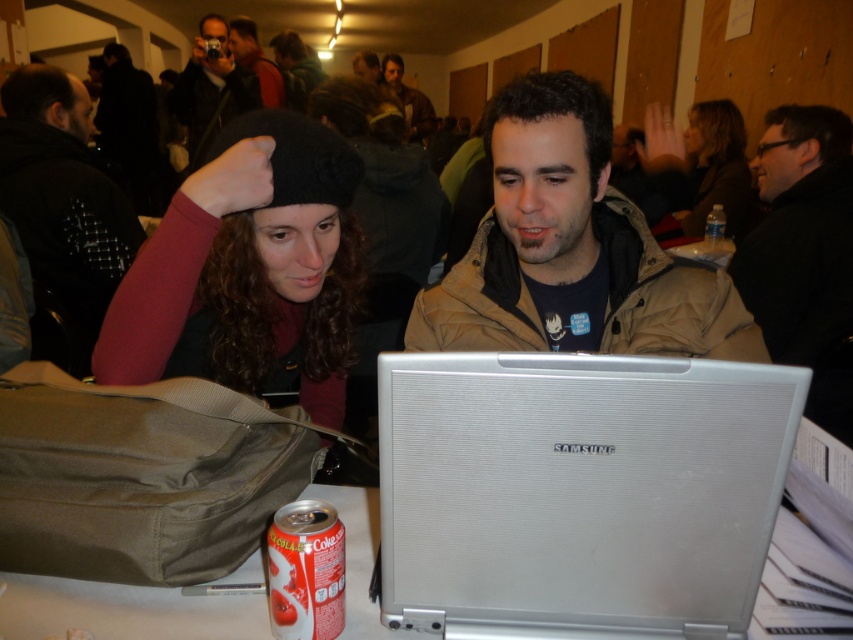
Which of these two, matte black jacket at upper center or clear plastic bottle at upper right, stands taller?

matte black jacket at upper center

The image size is (853, 640). Identify the location of matte black jacket at upper center. (256, 60).

Does beige textured jacket at center have a greater width compared to black matte jacket at upper right?

Indeed, beige textured jacket at center has a greater width compared to black matte jacket at upper right.

Is beige textured jacket at center positioned in front of black matte jacket at upper right?

Yes, beige textured jacket at center is in front of black matte jacket at upper right.

Is point (674, 280) less distant than point (846, 202)?

Yes, point (674, 280) is in front of point (846, 202).

Identify the location of beige textured jacket at center. (572, 250).

Is the position of black wool beret at upper left less distant than that of clear plastic bottle at upper right?

Yes.

In the scene shown: Who is more distant from viewer, (250, 173) or (706, 244)?

Point (706, 244)

Is point (259, 358) more distant than point (715, 221)?

No, it is in front of (715, 221).

Where is `black wool beret at upper left`? The height and width of the screenshot is (640, 853). black wool beret at upper left is located at coordinates [x=248, y=268].